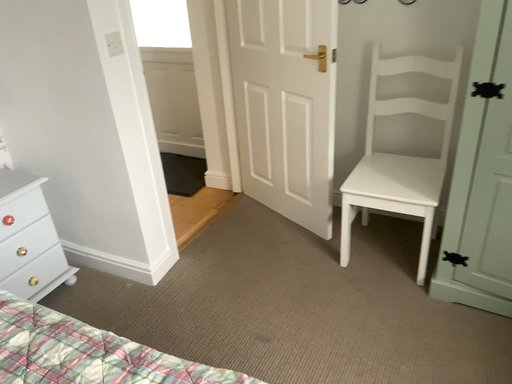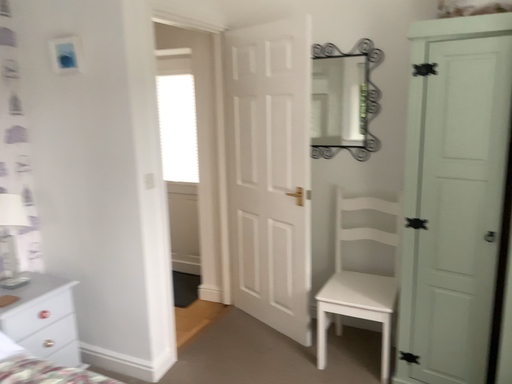
Question: How did the camera likely rotate when shooting the video?

Choices:
 (A) rotated downward
 (B) rotated upward

Answer: (B)